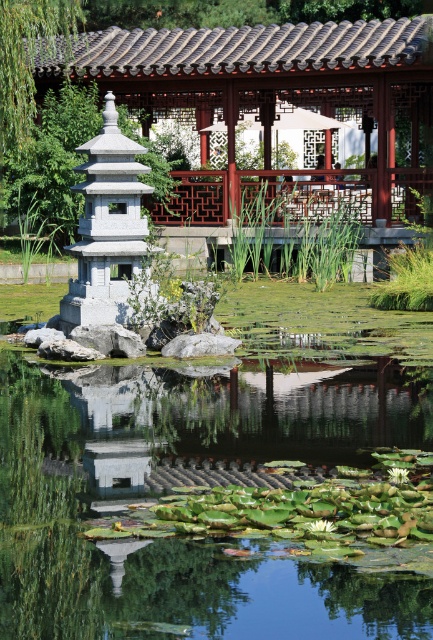
Question: Is green glossy pond at center closer to the viewer compared to wooden lattice gazebo at upper center?

Choices:
 (A) yes
 (B) no

Answer: (A)

Question: From the image, what is the correct spatial relationship of green glossy pond at center in relation to wooden lattice gazebo at upper center?

Choices:
 (A) above
 (B) below

Answer: (B)

Question: Can you confirm if green glossy pond at center is bigger than wooden lattice gazebo at upper center?

Choices:
 (A) yes
 (B) no

Answer: (B)

Question: Which of the following is the closest to the observer?

Choices:
 (A) green glossy pond at center
 (B) wooden lattice gazebo at upper center

Answer: (A)